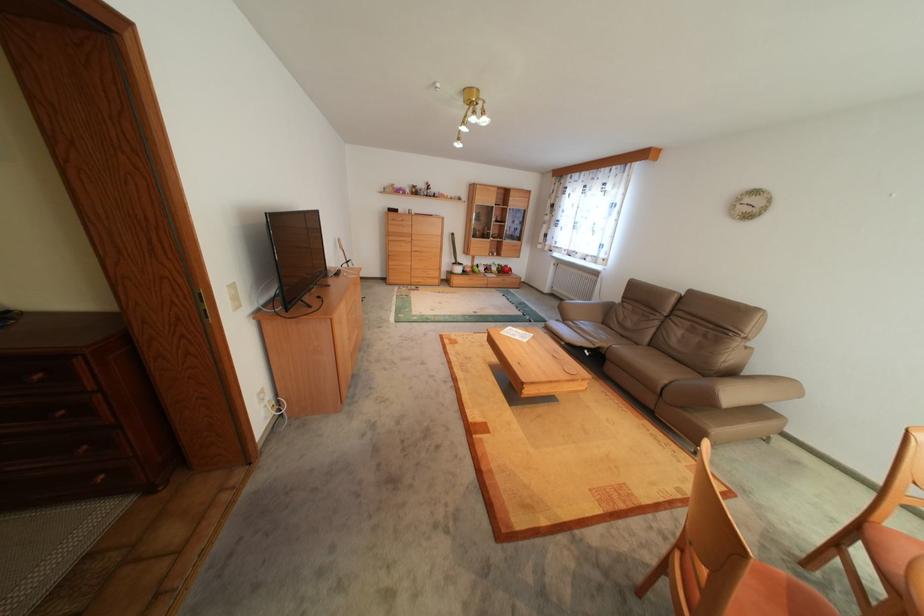
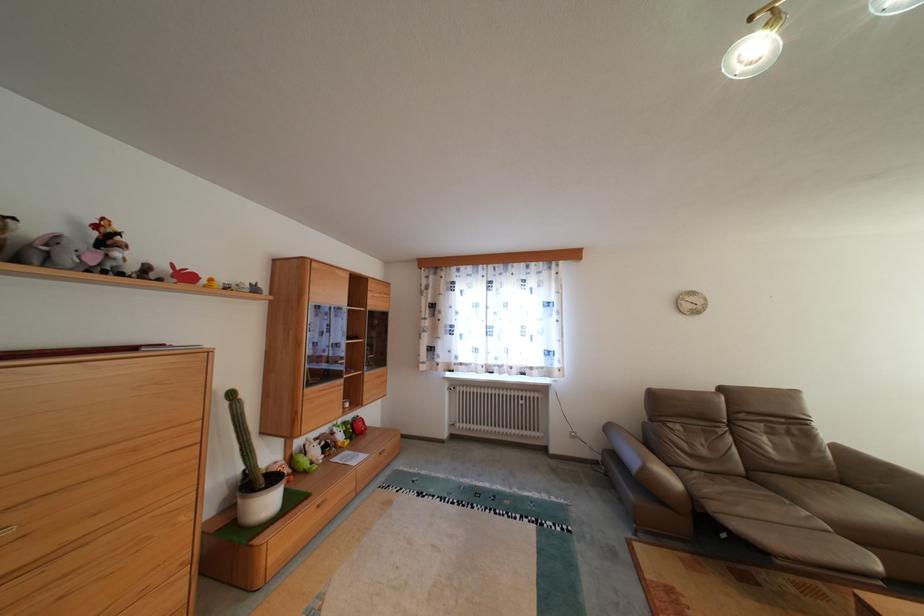
Where in the second image is the point corresponding to point (432, 193) from the first image?

(78, 257)